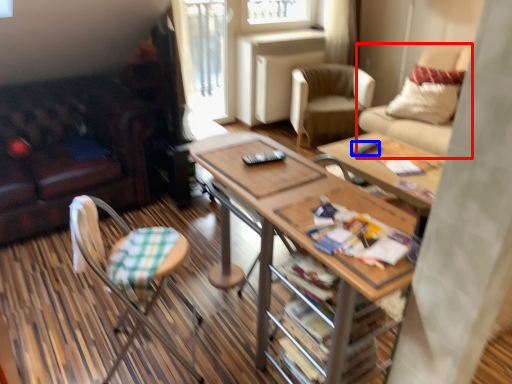
Question: Which point is further to the camera, chair (highlighted by a red box) or remote control (highlighted by a blue box)?

Choices:
 (A) chair
 (B) remote control

Answer: (A)